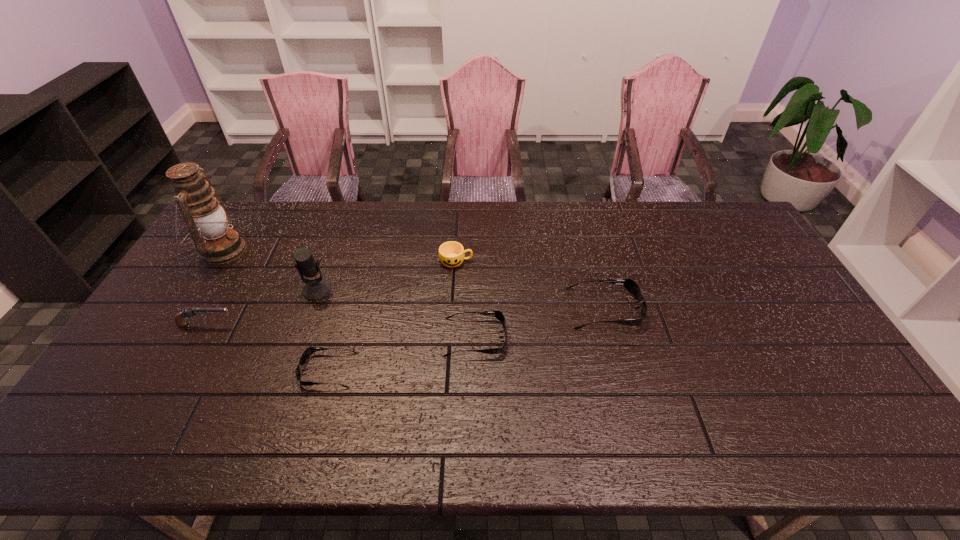
The image size is (960, 540). I want to click on vacant area that lies between the tallest object and the microphone, so click(x=270, y=270).

This screenshot has width=960, height=540. In order to click on unoccupied area between the third tallest object and the tallest sunglasses in this screenshot , I will do `click(405, 316)`.

You are a GUI agent. You are given a task and a screenshot of the screen. Output one action in this format:
    pyautogui.click(x=<x>, y=<y>)
    Task: Click on the free point between the second tallest sunglasses and the rightmost sunglasses
    This screenshot has height=540, width=960.
    Given the screenshot: What is the action you would take?
    pyautogui.click(x=540, y=323)

Identify the location of unoccupied position between the second shortest sunglasses and the lantern. This screenshot has height=540, width=960. [x=348, y=294].

Locate an element on the screen. This screenshot has height=540, width=960. vacant area between the shortest object and the lantern is located at coordinates (276, 310).

Identify the location of empty space between the rightmost object and the shortest object. [x=467, y=339].

Find the location of a particular element. vacant space in between the microphone and the second shortest object is located at coordinates [x=396, y=314].

You are a GUI agent. You are given a task and a screenshot of the screen. Output one action in this format:
    pyautogui.click(x=<x>, y=<y>)
    Task: Click on the empty space that is in between the sixth shortest object and the cup
    This screenshot has width=960, height=540.
    Given the screenshot: What is the action you would take?
    pyautogui.click(x=386, y=275)

Find the location of a particular element. Image resolution: width=960 pixels, height=540 pixels. free spot between the lantern and the tallest sunglasses is located at coordinates (414, 280).

Point out which object is positioned as the fourth nearest to the sixth shortest object. Please provide its 2D coordinates. Your answer should be formatted as a tuple, i.e. [(x, y)], where the tuple contains the x and y coordinates of a point satisfying the conditions above.

[(451, 254)]